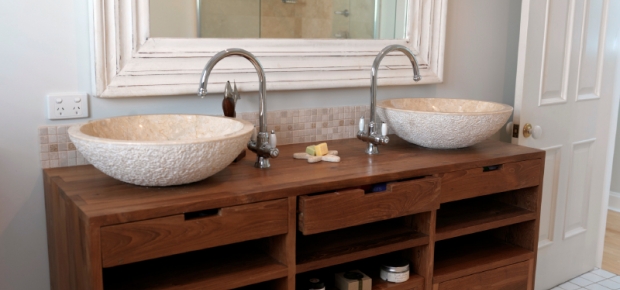
In order to click on light gray wall in this screenshot , I will do `click(24, 54)`.